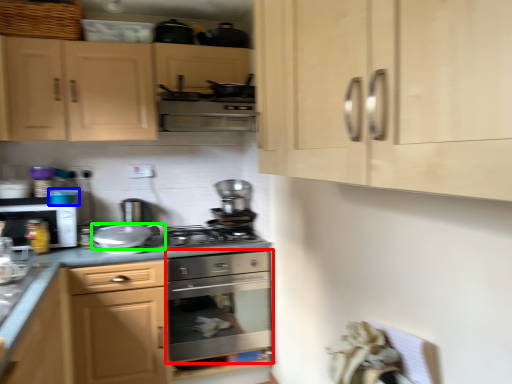
Question: Based on their relative distances, which object is nearer to home appliance (highlighted by a red box)? Choose from appliance (highlighted by a blue box) and appliance (highlighted by a green box).

Choices:
 (A) appliance
 (B) appliance

Answer: (B)